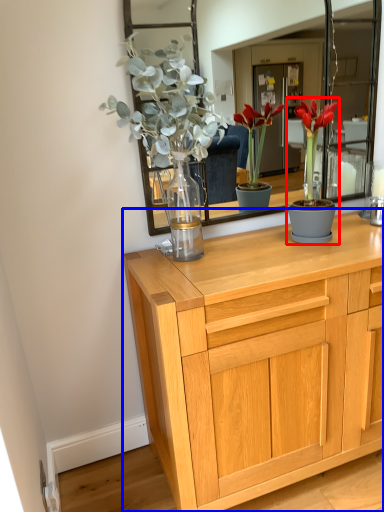
Question: Which of the following is the closest to the observer, houseplant (highlighted by a red box) or chest of drawers (highlighted by a blue box)?

Choices:
 (A) houseplant
 (B) chest of drawers

Answer: (B)